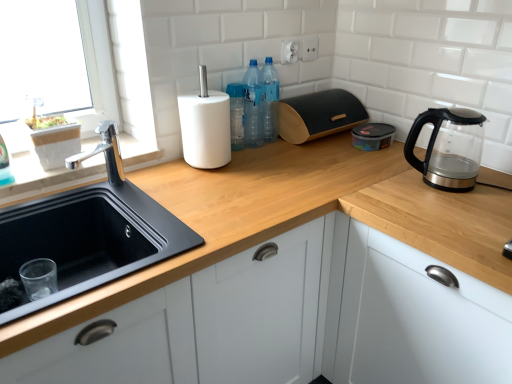
Locate an element on the screen. space that is in front of black wood bread bin at upper center is located at coordinates (329, 152).